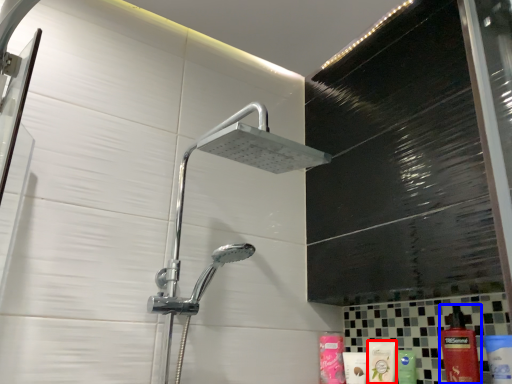
Question: Which point is further to the camera, mouthwash (highlighted by a red box) or cleaning product (highlighted by a blue box)?

Choices:
 (A) mouthwash
 (B) cleaning product

Answer: (A)